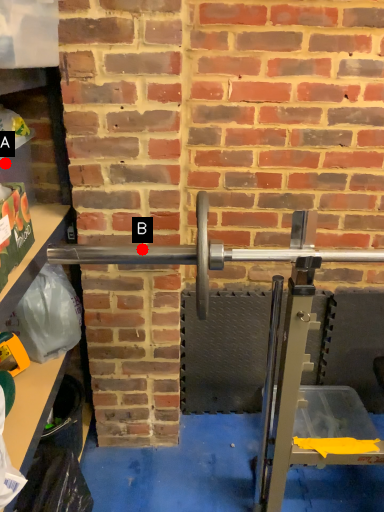
Question: Two points are circled on the image, labeled by A and B beside each circle. Which point is farther from the camera taking this photo?

Choices:
 (A) A is further
 (B) B is further

Answer: (A)